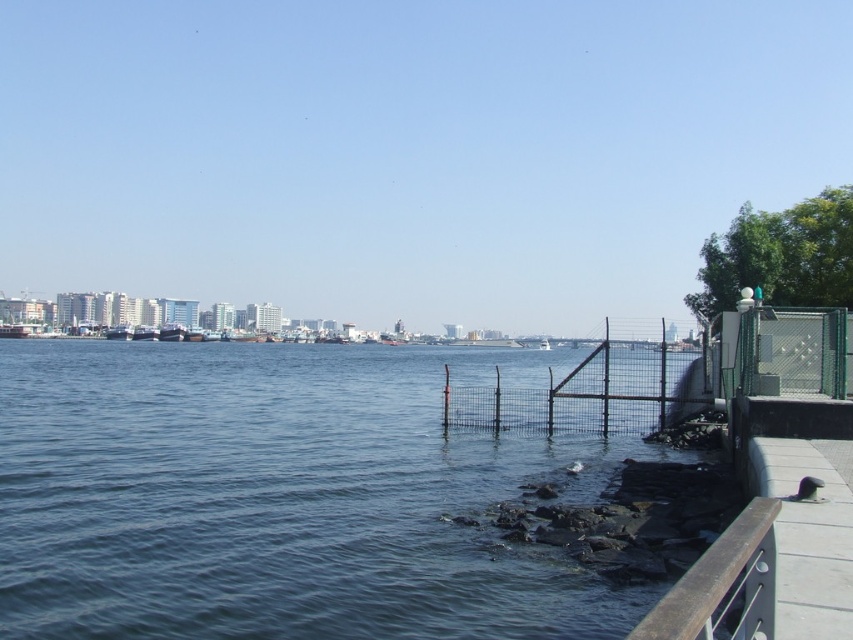
You are standing at the waterfront and want to take a photo of the blue water at lower left and the black wire fence at center. Which object will appear closer to the camera in your photo?

The blue water at lower left will appear closer to the camera in the photo because it is in front of the black wire fence at center.

In the scene shown: You are standing at the edge of the waterfront scene and want to compare the widths of the blue water at lower left and the brown wooden rail at lower right. Which one is wider?

The blue water at lower left is wider than the brown wooden rail at lower right according to the description.

You are standing on the walkway and see the blue water at lower left and the black wire fence at center. Which object is closer to your left side?

The blue water at lower left is closer to your left side because it is positioned to the left of the black wire fence at center.